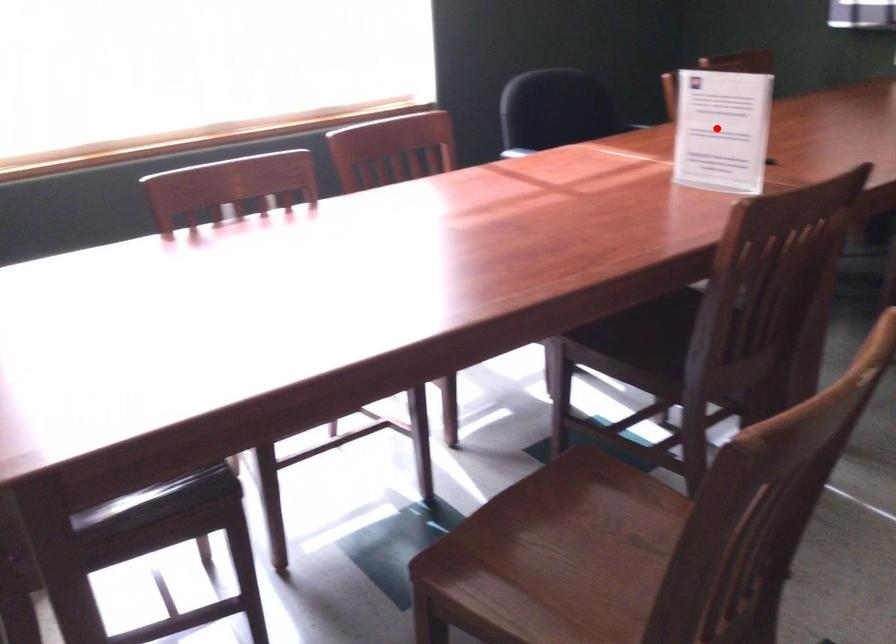
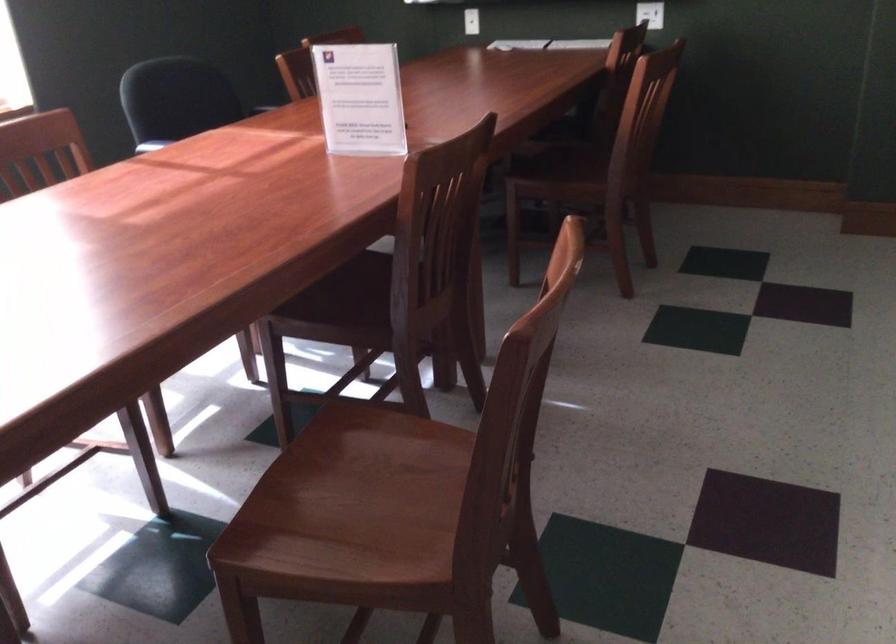
The point at the highlighted location is marked in the first image. Where is the corresponding point in the second image?

(359, 98)